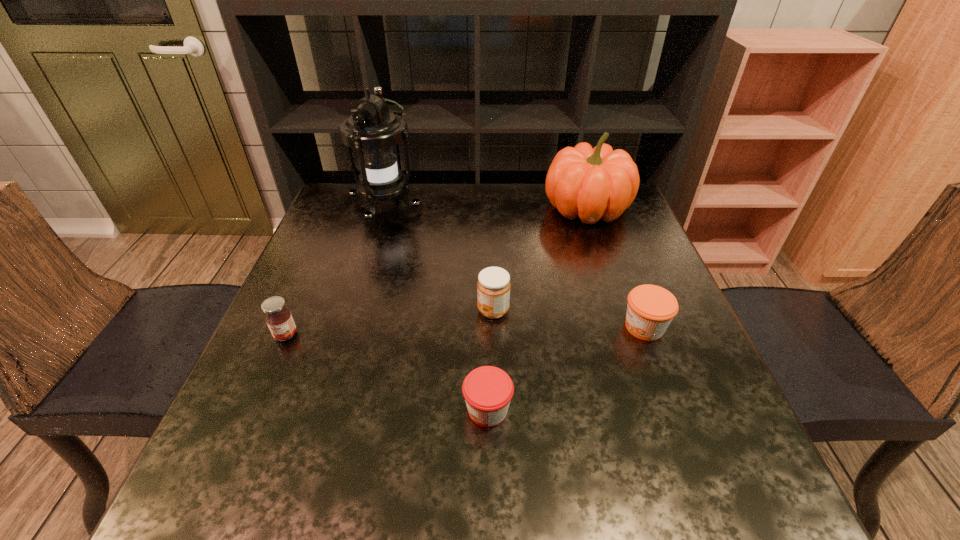
Image resolution: width=960 pixels, height=540 pixels. Find the location of `unoccupied position between the nearest jam and the second tallest object`. unoccupied position between the nearest jam and the second tallest object is located at coordinates (537, 309).

Find the location of `empty space that is in between the pumpkin and the rightmost jam`. empty space that is in between the pumpkin and the rightmost jam is located at coordinates 615,268.

The image size is (960, 540). I want to click on vacant area that lies between the rightmost jam and the second object from left to right, so click(516, 268).

Where is `free spot between the lantern and the leftmost jam`? This screenshot has height=540, width=960. free spot between the lantern and the leftmost jam is located at coordinates (336, 272).

Locate an element on the screen. unoccupied position between the leftmost object and the rightmost jam is located at coordinates (465, 331).

Locate an element on the screen. The image size is (960, 540). free space between the leftmost object and the tallest object is located at coordinates [336, 272].

You are a GUI agent. You are given a task and a screenshot of the screen. Output one action in this format:
    pyautogui.click(x=<x>, y=<y>)
    Task: Click on the object that is the third closest to the pumpkin
    The width and height of the screenshot is (960, 540).
    Given the screenshot: What is the action you would take?
    pyautogui.click(x=373, y=130)

Locate which object is the second closest to the leftmost jam. Please provide its 2D coordinates. Your answer should be formatted as a tuple, i.e. [(x, y)], where the tuple contains the x and y coordinates of a point satisfying the conditions above.

[(488, 390)]

Identify which jam is located as the third nearest to the tallest object. Please provide its 2D coordinates. Your answer should be formatted as a tuple, i.e. [(x, y)], where the tuple contains the x and y coordinates of a point satisfying the conditions above.

[(488, 390)]

Image resolution: width=960 pixels, height=540 pixels. In order to click on jam that is the fourth closest one to the pumpkin in this screenshot , I will do click(x=278, y=317).